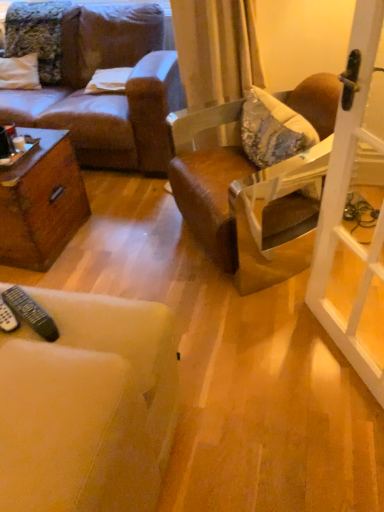
Describe the element at coordinates (31, 313) in the screenshot. I see `black plastic remote at lower left, which ranks as the second remote control in left-to-right order` at that location.

What do you see at coordinates (347, 192) in the screenshot?
I see `white glass screen door at right` at bounding box center [347, 192].

The width and height of the screenshot is (384, 512). In order to click on black plastic remote at lower left, arranged as the first remote control when viewed from the right in this screenshot , I will do `click(31, 313)`.

How many degrees apart are the facing directions of white glass screen door at right and brown leather chair at center?

They differ by 4.83 degrees in their facing directions.

From the image's perspective, between white glass screen door at right and brown leather chair at center, who is located below?

white glass screen door at right is shown below in the image.

Which object is positioned more to the left, white glass screen door at right or brown leather chair at center?

brown leather chair at center.

Which object is further away from the camera taking this photo, white glass screen door at right or brown leather chair at center?

brown leather chair at center is more distant.

Which of these two, brown leather chair at center or black plastic remote at lower left, arranged as the first remote control when viewed from the right, is thinner?

With smaller width is black plastic remote at lower left, arranged as the first remote control when viewed from the right.

From a real-world perspective, is brown leather chair at center positioned over black plastic remote at lower left, which ranks as the second remote control in left-to-right order, based on gravity?

No.

Can we say brown leather chair at center lies outside black plastic remote at lower left, which ranks as the second remote control in left-to-right order?

brown leather chair at center is positioned outside black plastic remote at lower left, which ranks as the second remote control in left-to-right order.

Is brown leather chair at center bigger than black plastic remote at lower left, which ranks as the second remote control in left-to-right order?

Yes.

How much distance is there between white fabric pillow at upper center and black plastic remote at lower left, which ranks as the second remote control in left-to-right order?

white fabric pillow at upper center is 1.86 meters away from black plastic remote at lower left, which ranks as the second remote control in left-to-right order.

Which object is positioned more to the left, white fabric pillow at upper center or black plastic remote at lower left, arranged as the first remote control when viewed from the right?

From the viewer's perspective, white fabric pillow at upper center appears more on the left side.

Looking at this image, could you tell me if white fabric pillow at upper center is facing black plastic remote at lower left, which ranks as the second remote control in left-to-right order?

Yes, white fabric pillow at upper center is turned towards black plastic remote at lower left, which ranks as the second remote control in left-to-right order.

From the image's perspective, which remote control is the 2nd one below the white fabric pillow at upper center? Please provide its 2D coordinates.

[(31, 313)]

Is brown leather chair at center touching black plastic remote control at lower left, the second remote control in the right-to-left sequence?

brown leather chair at center is not next to black plastic remote control at lower left, the second remote control in the right-to-left sequence, and they're not touching.

From the picture: Is brown leather chair at center taller than black plastic remote control at lower left, the second remote control in the right-to-left sequence?

Yes, brown leather chair at center is taller than black plastic remote control at lower left, the second remote control in the right-to-left sequence.

Which object is closer to the camera, brown leather chair at center or black plastic remote control at lower left, which is counted as the first remote control, starting from the left?

black plastic remote control at lower left, which is counted as the first remote control, starting from the left, is in front.

How different are the orientations of brown leather chair at center and black plastic remote control at lower left, which is counted as the first remote control, starting from the left, in degrees?

72.2 degrees separate the facing orientations of brown leather chair at center and black plastic remote control at lower left, which is counted as the first remote control, starting from the left.

Could you measure the distance between black plastic remote at lower left, arranged as the first remote control when viewed from the right, and white glass screen door at right?

black plastic remote at lower left, arranged as the first remote control when viewed from the right, is 1.03 meters away from white glass screen door at right.

Is black plastic remote at lower left, arranged as the first remote control when viewed from the right, taller or shorter than white glass screen door at right?

Considering their sizes, black plastic remote at lower left, arranged as the first remote control when viewed from the right, has less height than white glass screen door at right.

Is black plastic remote at lower left, arranged as the first remote control when viewed from the right, looking in the opposite direction of white glass screen door at right?

No, white glass screen door at right is not at the back of black plastic remote at lower left, arranged as the first remote control when viewed from the right.

Does black plastic remote at lower left, arranged as the first remote control when viewed from the right, come in front of white glass screen door at right?

No.

Does point (328, 250) lie behind point (98, 72)?

No, it is not.

In the scene shown: From a real-world perspective, is white glass screen door at right below white fabric pillow at upper center?

No, from a real-world perspective, white glass screen door at right is not beneath white fabric pillow at upper center.

Is white glass screen door at right at the right side of white fabric pillow at upper center?

Correct, you'll find white glass screen door at right to the right of white fabric pillow at upper center.

This screenshot has width=384, height=512. I want to click on pillow that is under the white glass screen door at right (from a real-world perspective), so click(x=109, y=80).

From a real-world perspective, which is physically below, black plastic remote at lower left, which ranks as the second remote control in left-to-right order, or white fabric pillow at upper center?

white fabric pillow at upper center.

Is black plastic remote at lower left, which ranks as the second remote control in left-to-right order, inside the boundaries of white fabric pillow at upper center, or outside?

black plastic remote at lower left, which ranks as the second remote control in left-to-right order, is outside white fabric pillow at upper center.

Considering the sizes of objects black plastic remote at lower left, arranged as the first remote control when viewed from the right, and white fabric pillow at upper center in the image provided, who is thinner, black plastic remote at lower left, arranged as the first remote control when viewed from the right, or white fabric pillow at upper center?

black plastic remote at lower left, arranged as the first remote control when viewed from the right.

Is black plastic remote at lower left, arranged as the first remote control when viewed from the right, in front of or behind white fabric pillow at upper center in the image?

Clearly, black plastic remote at lower left, arranged as the first remote control when viewed from the right, is in front of white fabric pillow at upper center.

At what (x,y) coordinates should I click in order to perform the action: click on chair that appears on the left of white glass screen door at right. Please return your answer as a coordinate pair (x, y). The height and width of the screenshot is (512, 384). Looking at the image, I should click on (240, 217).

You are a GUI agent. You are given a task and a screenshot of the screen. Output one action in this format:
    pyautogui.click(x=<x>, y=<y>)
    Task: Click on the chair below the black plastic remote at lower left, which ranks as the second remote control in left-to-right order (from a real-world perspective)
    
    Given the screenshot: What is the action you would take?
    pyautogui.click(x=240, y=217)

Based on their spatial positions, is white fabric pillow at upper center or black plastic remote at lower left, arranged as the first remote control when viewed from the right, closer to brown leather chair at center?

Among the two, black plastic remote at lower left, arranged as the first remote control when viewed from the right, is located nearer to brown leather chair at center.

When comparing their distances from brown leather chair at center, does white glass screen door at right or white fabric pillow at upper center seem further?

Among the two, white fabric pillow at upper center is located further to brown leather chair at center.

From the image, which object appears to be farther from black plastic remote at lower left, arranged as the first remote control when viewed from the right, black plastic remote control at lower left, the second remote control in the right-to-left sequence, or white glass screen door at right?

Among the two, white glass screen door at right is located further to black plastic remote at lower left, arranged as the first remote control when viewed from the right.

From the image, which object appears to be farther from white fabric pillow at upper center, black plastic remote control at lower left, which is counted as the first remote control, starting from the left, or white glass screen door at right?

Based on the image, black plastic remote control at lower left, which is counted as the first remote control, starting from the left, appears to be further to white fabric pillow at upper center.

From the image, which object appears to be farther from white glass screen door at right, black plastic remote at lower left, which ranks as the second remote control in left-to-right order, or black plastic remote control at lower left, the second remote control in the right-to-left sequence?

black plastic remote control at lower left, the second remote control in the right-to-left sequence, lies further to white glass screen door at right than the other object.

Looking at the image, which one is located further to white fabric pillow at upper center, black plastic remote control at lower left, which is counted as the first remote control, starting from the left, or brown leather chair at center?

The object further to white fabric pillow at upper center is black plastic remote control at lower left, which is counted as the first remote control, starting from the left.

From the image, which object appears to be nearer to black plastic remote control at lower left, which is counted as the first remote control, starting from the left, brown leather chair at center or black plastic remote at lower left, which ranks as the second remote control in left-to-right order?

The object closer to black plastic remote control at lower left, which is counted as the first remote control, starting from the left, is black plastic remote at lower left, which ranks as the second remote control in left-to-right order.

Based on their spatial positions, is white fabric pillow at upper center or brown leather chair at center closer to black plastic remote control at lower left, which is counted as the first remote control, starting from the left?

Based on the image, brown leather chair at center appears to be nearer to black plastic remote control at lower left, which is counted as the first remote control, starting from the left.

Where is `chair between black plastic remote at lower left, which ranks as the second remote control in left-to-right order, and white glass screen door at right from left to right`? The image size is (384, 512). chair between black plastic remote at lower left, which ranks as the second remote control in left-to-right order, and white glass screen door at right from left to right is located at coordinates (240, 217).

Where is `remote control situated between black plastic remote control at lower left, which is counted as the first remote control, starting from the left, and brown leather chair at center from left to right`? remote control situated between black plastic remote control at lower left, which is counted as the first remote control, starting from the left, and brown leather chair at center from left to right is located at coordinates (31, 313).

Find the location of `remote control positioned between black plastic remote at lower left, arranged as the first remote control when viewed from the right, and white fabric pillow at upper center from near to far`. remote control positioned between black plastic remote at lower left, arranged as the first remote control when viewed from the right, and white fabric pillow at upper center from near to far is located at coordinates (7, 317).

In order to click on chair located between white glass screen door at right and white fabric pillow at upper center in the depth direction in this screenshot , I will do (240, 217).